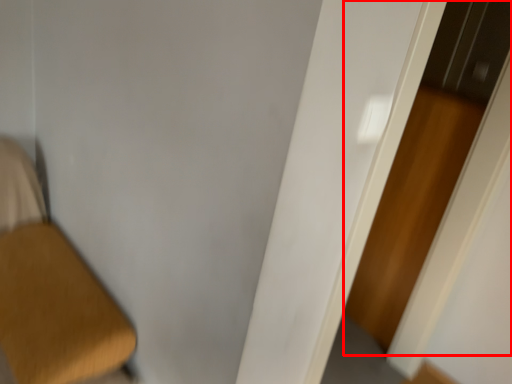
Question: In this image, where is screen door (annotated by the red box) located relative to door?

Choices:
 (A) right
 (B) left

Answer: (A)